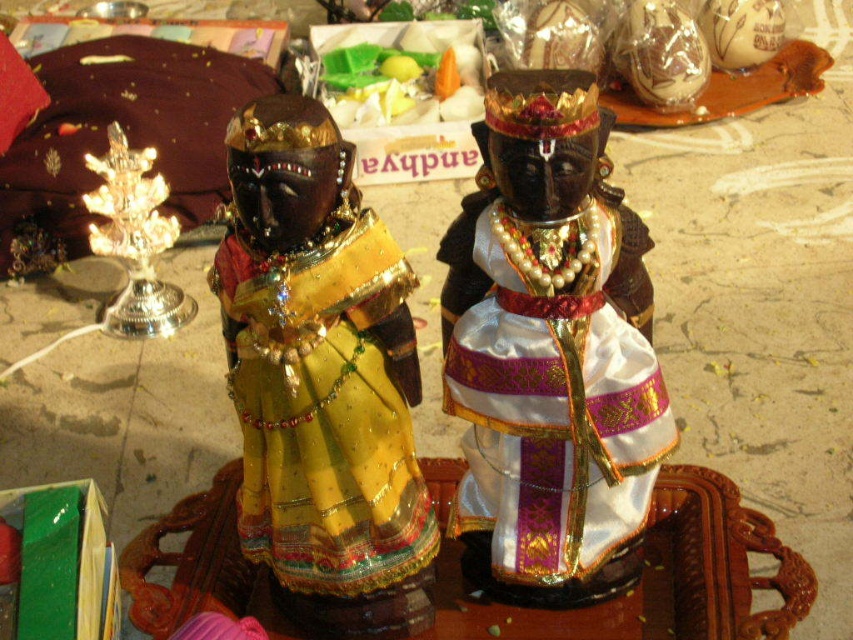
Question: Can you confirm if metallic gold figurine at center is smaller than white satin dress at center?

Choices:
 (A) no
 (B) yes

Answer: (A)

Question: From the image, what is the correct spatial relationship of metallic gold figurine at center in relation to shiny silver candlestick at left?

Choices:
 (A) right
 (B) left

Answer: (A)

Question: Can you confirm if metallic gold figurine at center is wider than shiny silver candlestick at left?

Choices:
 (A) yes
 (B) no

Answer: (A)

Question: Which object is closer to the camera taking this photo?

Choices:
 (A) shiny silver candlestick at left
 (B) white satin dress at center
 (C) metallic gold figurine at center

Answer: (C)

Question: Which of these objects is positioned farthest from the metallic gold figurine at center?

Choices:
 (A) white satin dress at center
 (B) shiny silver candlestick at left

Answer: (B)

Question: Based on their relative distances, which object is nearer to the shiny silver candlestick at left?

Choices:
 (A) white satin dress at center
 (B) metallic gold figurine at center

Answer: (B)